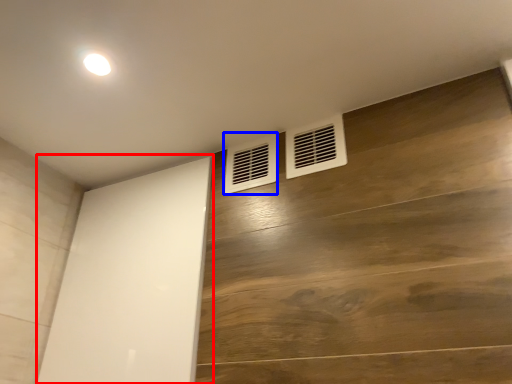
Question: Which of the following is the farthest to the observer, screen door (highlighted by a red box) or air conditioning (highlighted by a blue box)?

Choices:
 (A) screen door
 (B) air conditioning

Answer: (B)